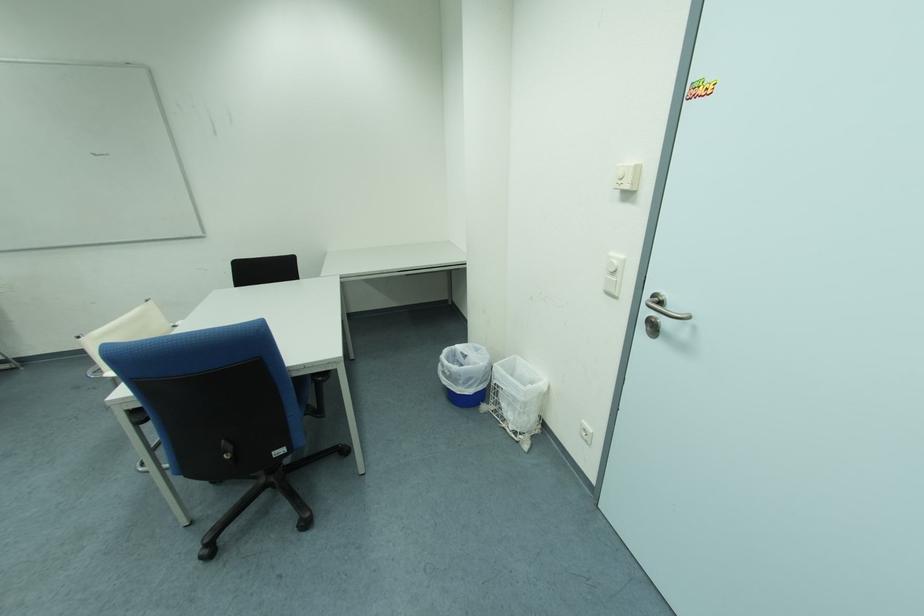
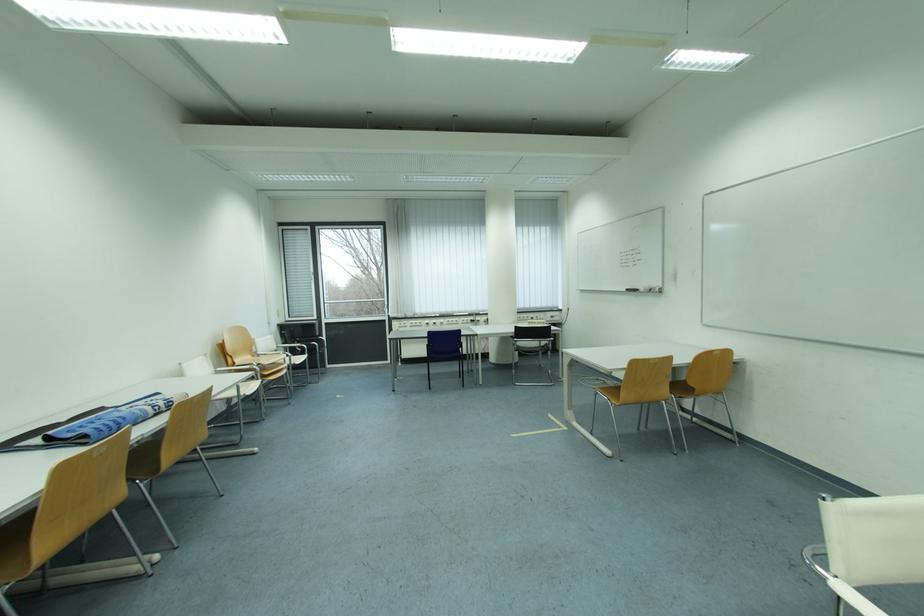
Question: The camera is either moving clockwise (left) or counter-clockwise (right) around the object. The first image is from the beginning of the video and the second image is from the end. Is the camera moving left or right when shooting the video?

Choices:
 (A) Left
 (B) Right

Answer: (B)